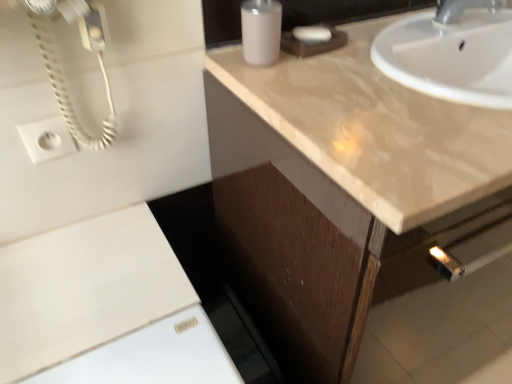
Locate an element on the screen. empty space that is ontop of glossy beige countertop at upper right is located at coordinates (394, 65).